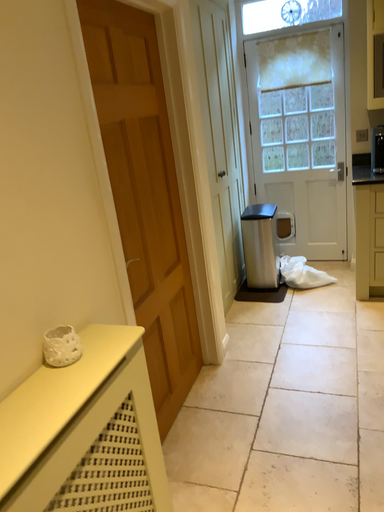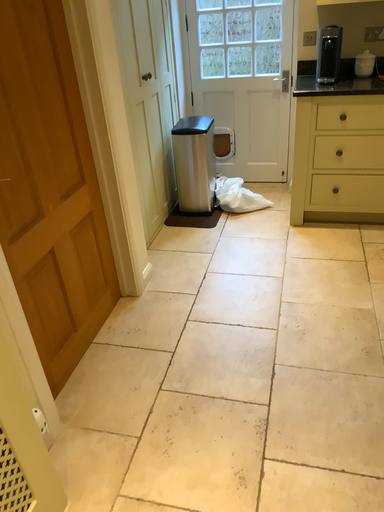
Question: How did the camera likely rotate when shooting the video?

Choices:
 (A) rotated upward
 (B) rotated downward

Answer: (B)